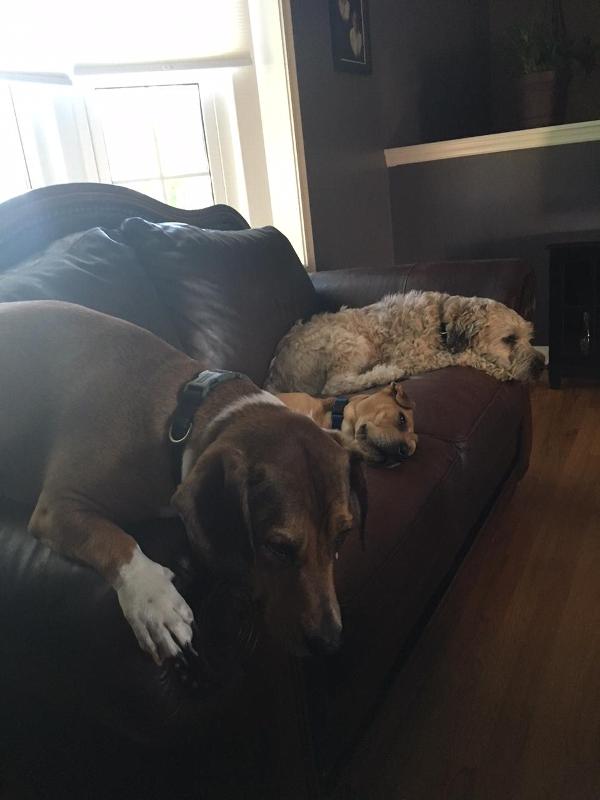
Where is `window`? Image resolution: width=600 pixels, height=800 pixels. window is located at coordinates (189, 130).